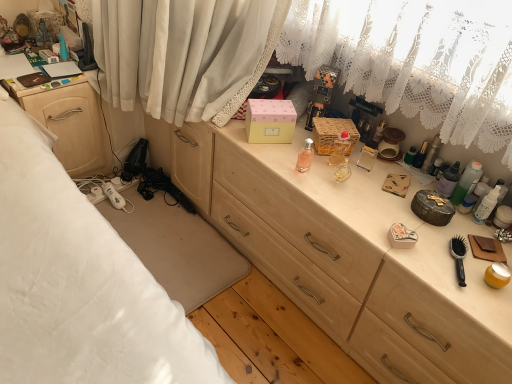
I want to click on vacant area that is in front of translucent plastic bottles at right, the second toiletry when ordered from right to left, so click(466, 225).